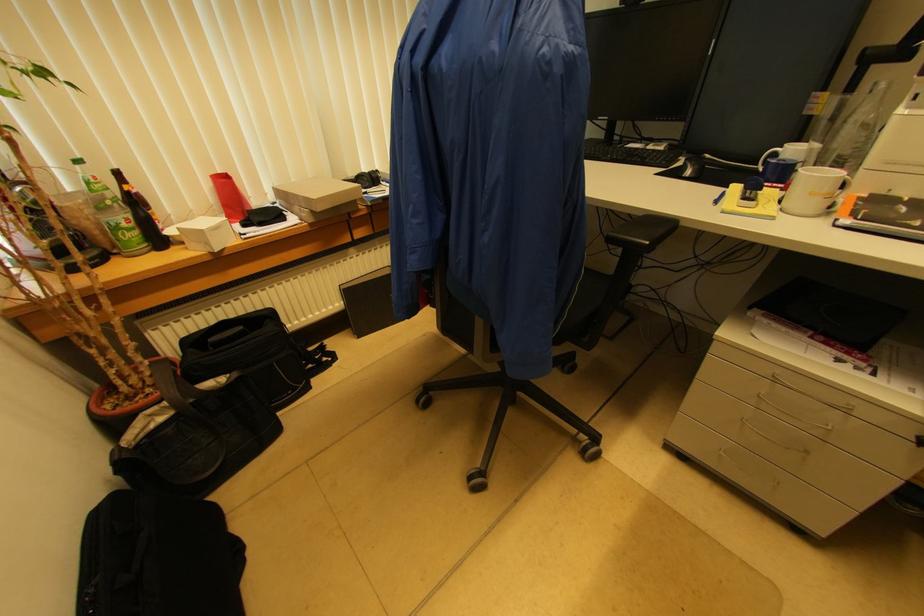
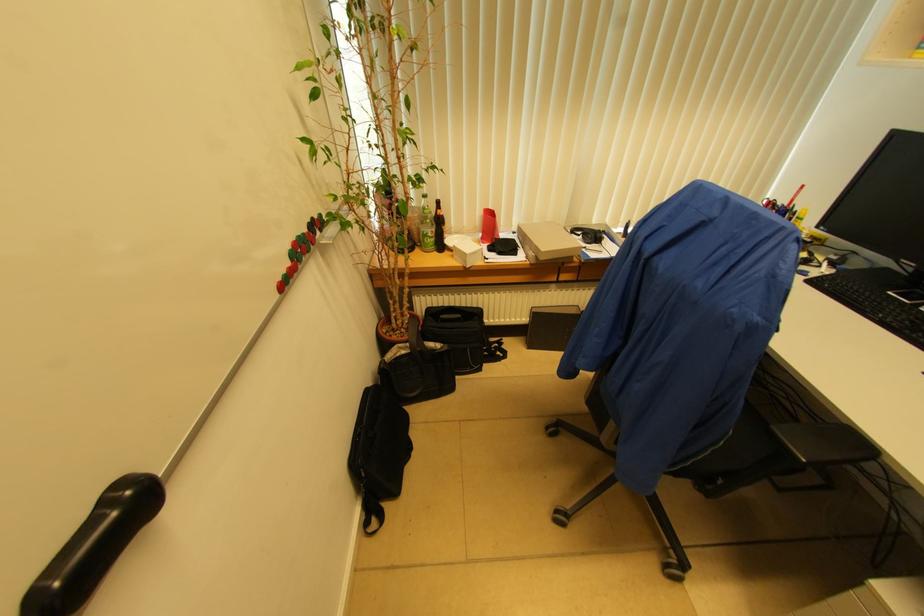
Locate, in the second image, the point that corresponds to (649,243) in the first image.

(807, 461)